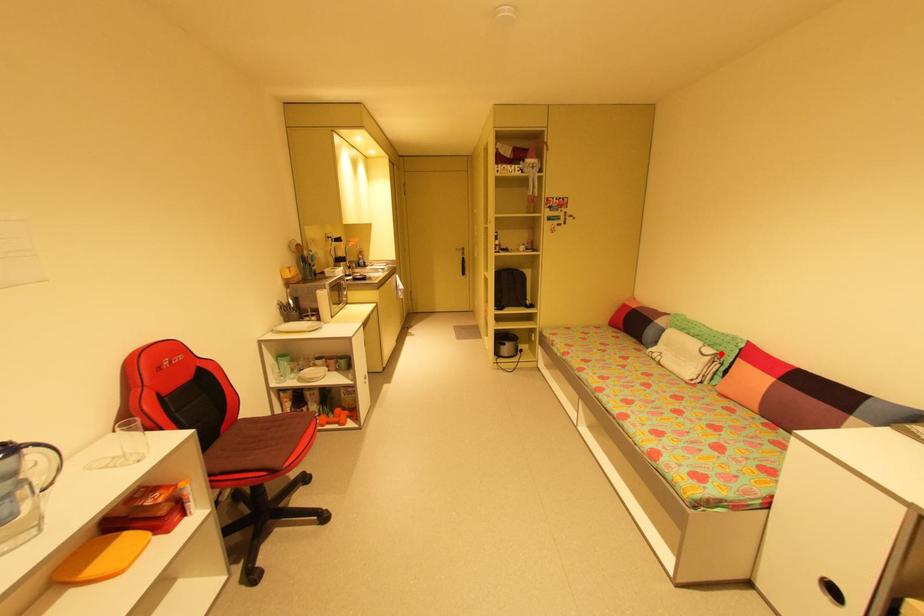
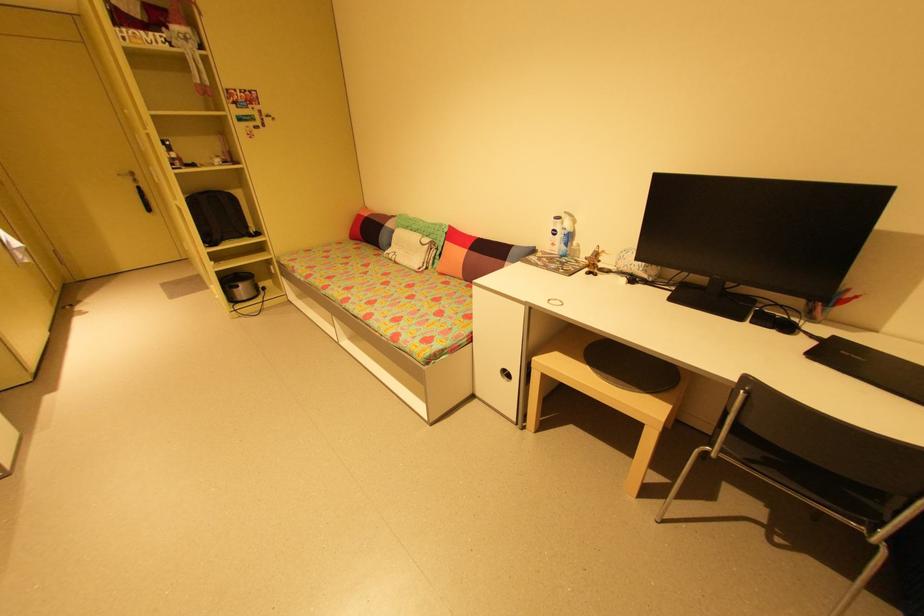
Find the pixel in the second image that matches the highlighted location in the first image.

(435, 241)